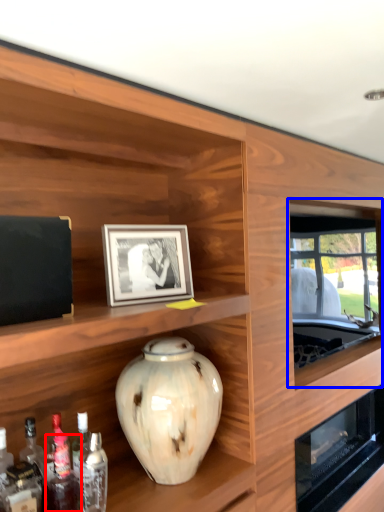
Question: Among these objects, which one is farthest to the camera, bottle (highlighted by a red box) or window (highlighted by a blue box)?

Choices:
 (A) bottle
 (B) window

Answer: (B)